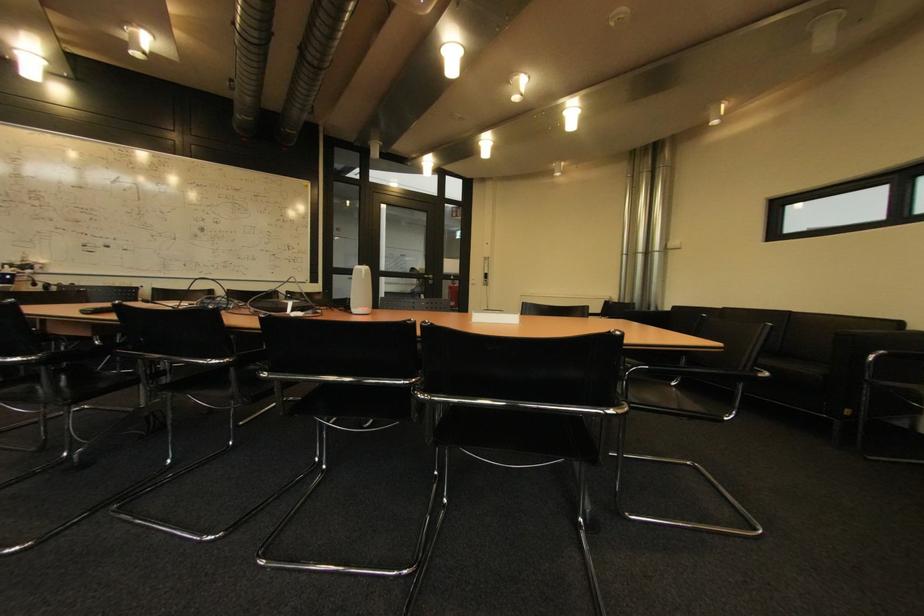
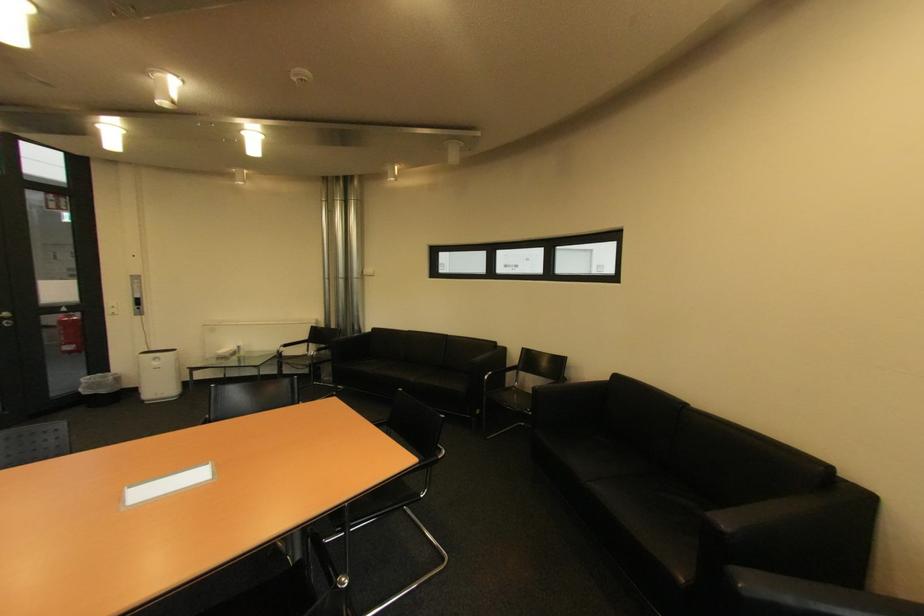
In the second image, find the point that corresponds to pixel 892 353 in the first image.

(499, 374)